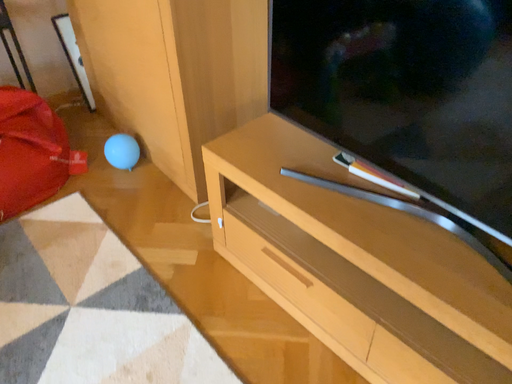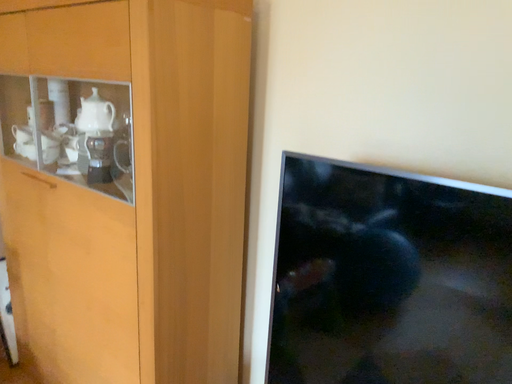
Question: How did the camera likely rotate when shooting the video?

Choices:
 (A) rotated upward
 (B) rotated downward

Answer: (A)